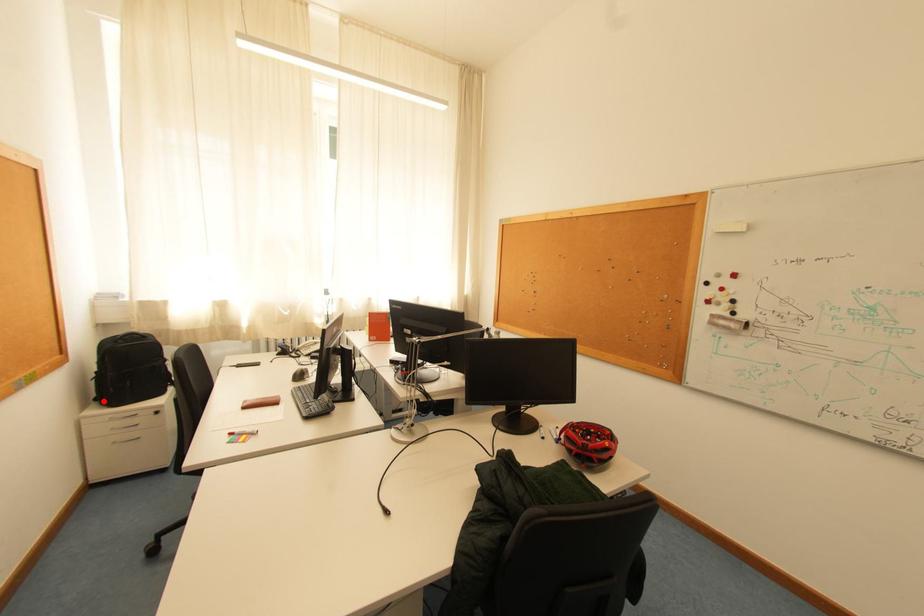
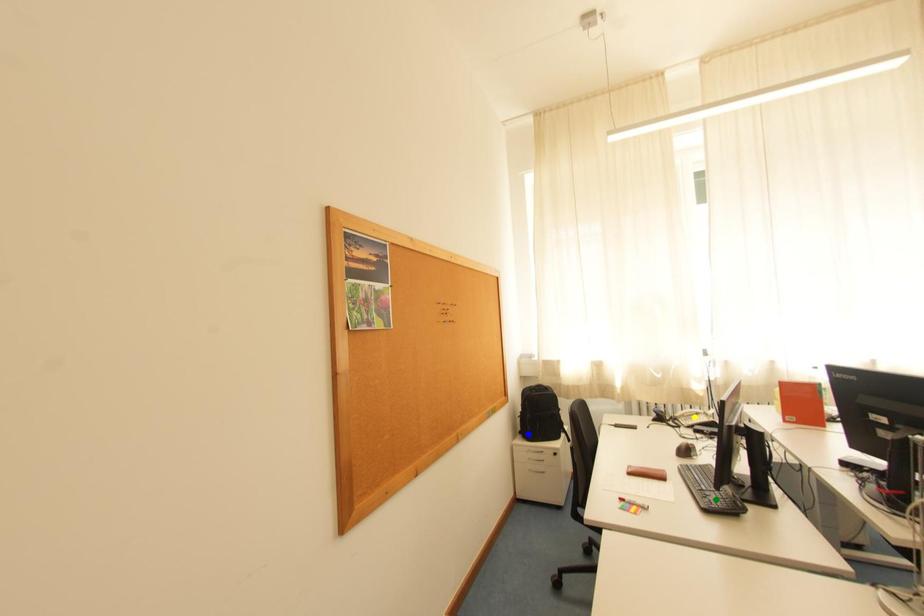
Question: I am providing you with two images of the same scene from different viewpoints. A red point is marked on the first image. You are given multiple points on the second image. Which mark in image 2 goes with the point in image 1?

Choices:
 (A) blue point
 (B) green point
 (C) yellow point

Answer: (A)